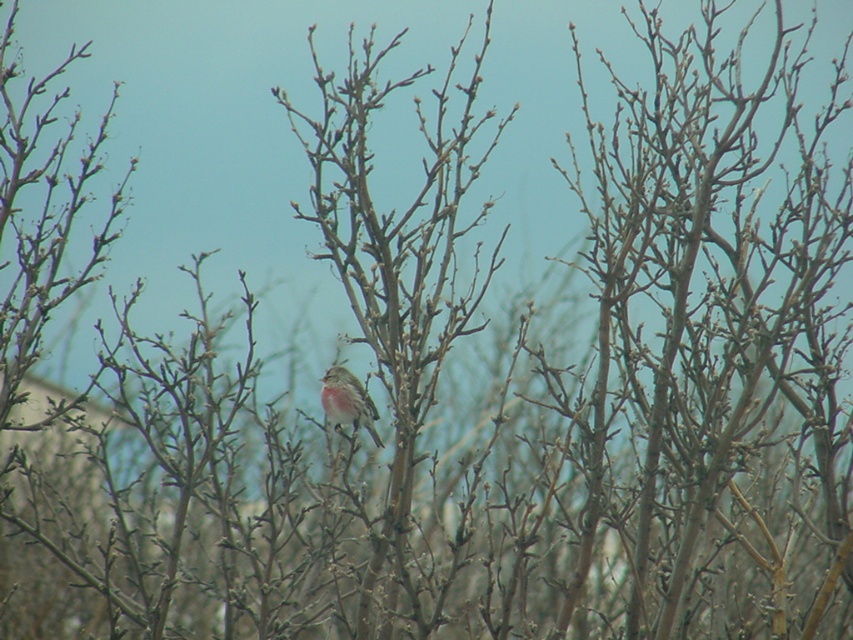
Does smooth brown branches at center appear under brown speckled sparrow at center?

No, smooth brown branches at center is not below brown speckled sparrow at center.

Who is more distant from viewer, (341, 236) or (358, 422)?

The point (358, 422) is behind.

Who is more forward, (454,230) or (338,374)?

Point (338,374) is in front.

You are a GUI agent. You are given a task and a screenshot of the screen. Output one action in this format:
    pyautogui.click(x=<x>, y=<y>)
    Task: Click on the smooth brown branches at center
    The image size is (853, 640).
    Given the screenshot: What is the action you would take?
    pyautogui.click(x=397, y=260)